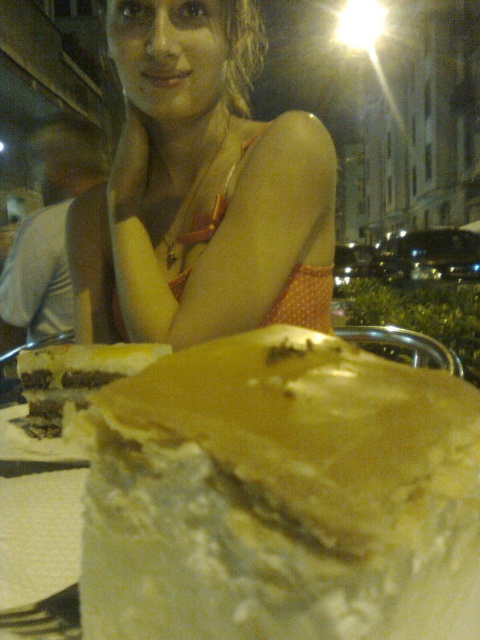
Between point (108, 593) and point (111, 369), which one is positioned in front?

Positioned in front is point (108, 593).

Looking at this image, is white creamy cake at center thinner than yellow cake at center?

No.

Is point (437, 403) less distant than point (29, 356)?

Yes, it is.

Where is `white creamy cake at center`? The width and height of the screenshot is (480, 640). white creamy cake at center is located at coordinates (282, 497).

Is the position of white creamy cake at center more distant than that of orange polka dot dress at upper center?

No, white creamy cake at center is in front of orange polka dot dress at upper center.

Identify the location of white creamy cake at center. (282, 497).

Which is in front, point (351, 595) or point (149, 64)?

Point (351, 595) is more forward.

This screenshot has height=640, width=480. In order to click on white creamy cake at center in this screenshot , I will do `click(282, 497)`.

Can you confirm if orange polka dot dress at upper center is positioned to the right of yellow cake at center?

Yes, orange polka dot dress at upper center is to the right of yellow cake at center.

You are a GUI agent. You are given a task and a screenshot of the screen. Output one action in this format:
    pyautogui.click(x=<x>, y=<y>)
    Task: Click on the orange polka dot dress at upper center
    This screenshot has width=480, height=640.
    Given the screenshot: What is the action you would take?
    pyautogui.click(x=201, y=189)